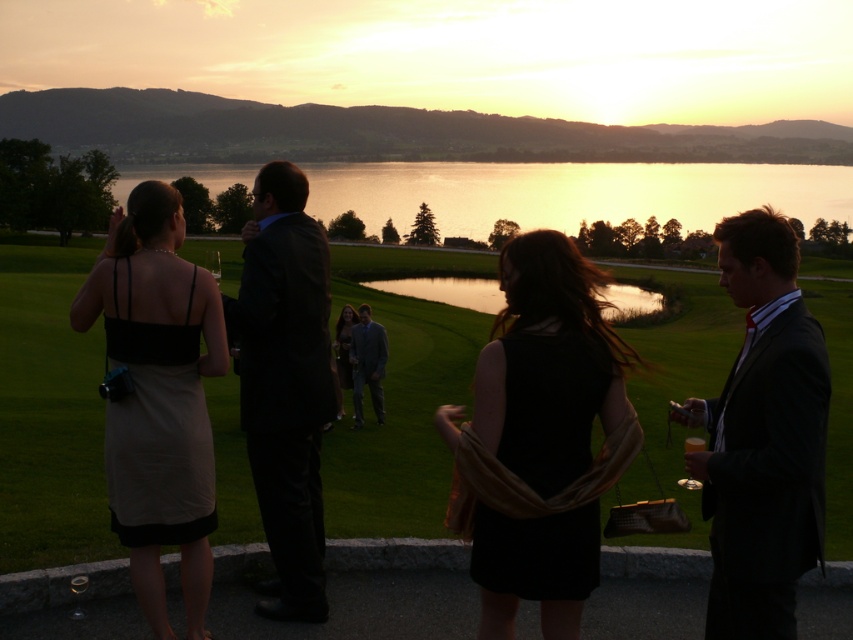
You are a photographer planning to take a group photo of the matte black dress at left and the green grass golf course at center. Since you want to ensure the subjects are properly framed, which object should you place closer to the camera to make it appear larger in the photo?

To make the matte black dress at left appear larger in the photo, you should place it closer to the camera since it is shorter than the green grass golf course at center. Objects closer to the camera appear larger in photographs.

You are attending an outdoor evening event and notice two people wearing black attire at the center of the scene. The shiny black suit at center and the matte black dress at center. Based on their positions, which one is standing closer to the front?

The shiny black suit at center is located above the matte black dress at center, meaning it is positioned closer to the front of the scene.